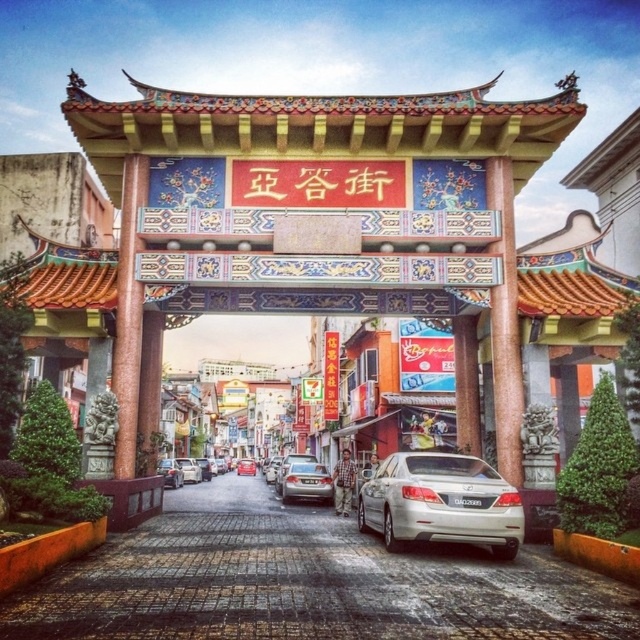
Can you confirm if satin silver sedan at center is positioned below shiny silver sedan at center?

Actually, satin silver sedan at center is above shiny silver sedan at center.

Between satin silver sedan at center and shiny silver sedan at center, which one is positioned higher?

Positioned higher is satin silver sedan at center.

At what (x,y) coordinates should I click in order to perform the action: click on satin silver sedan at center. Please return your answer as a coordinate pair (x, y). Image resolution: width=640 pixels, height=640 pixels. Looking at the image, I should click on (307, 483).

Can you confirm if shiny silver sedan at center is shorter than metallic silver sedan at center?

Incorrect, shiny silver sedan at center's height does not fall short of metallic silver sedan at center's.

Does point (173, 483) come in front of point (250, 460)?

Yes, it is in front of point (250, 460).

Which is in front, point (172, 458) or point (248, 467)?

Positioned in front is point (172, 458).

The height and width of the screenshot is (640, 640). Identify the location of shiny silver sedan at center. (170, 472).

The height and width of the screenshot is (640, 640). Find the location of `silver metallic sedan at center`. silver metallic sedan at center is located at coordinates (440, 502).

Where is `silver metallic sedan at center`? The height and width of the screenshot is (640, 640). silver metallic sedan at center is located at coordinates (440, 502).